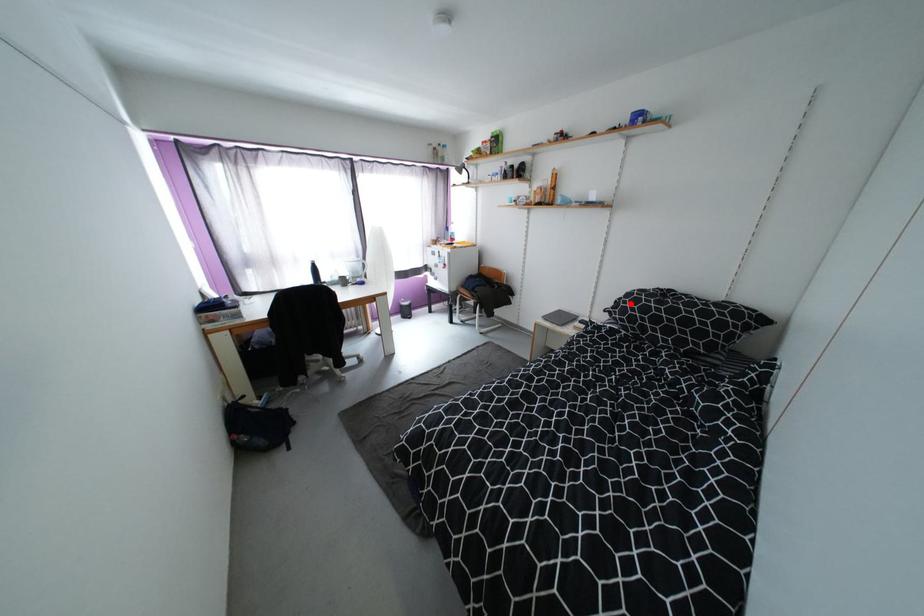
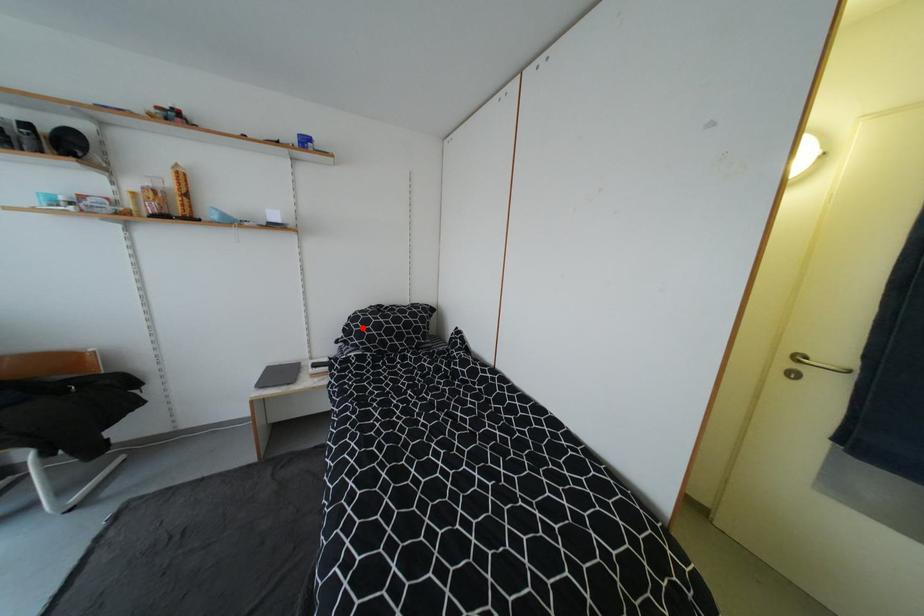
From the picture: I am providing you with two images of the same scene from different viewpoints. A red point is marked on the first image and another point is marked on the second image. Is the red point in image1 aligned with the point shown in image2?

Yes